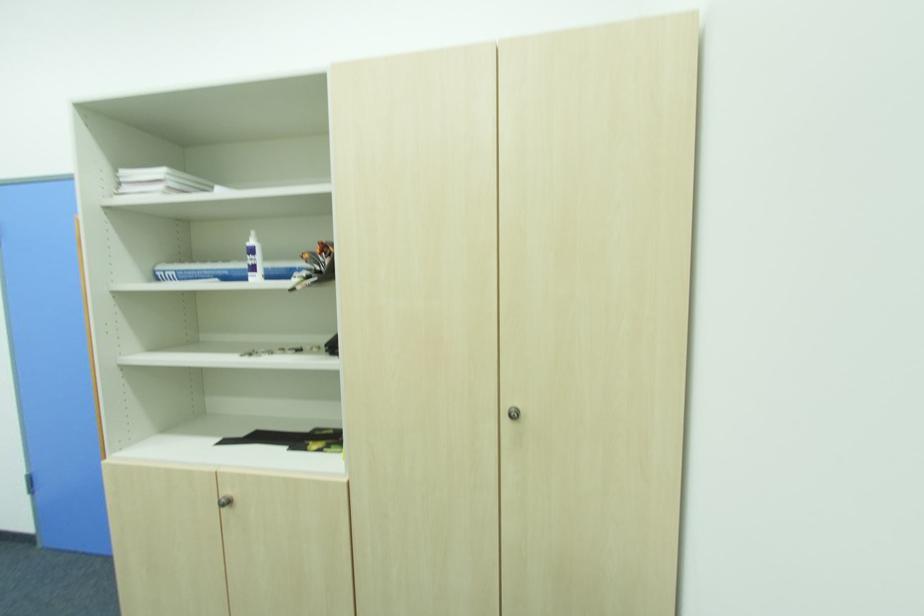
What do you see at coordinates (225, 501) in the screenshot? I see `the small cabinet knob` at bounding box center [225, 501].